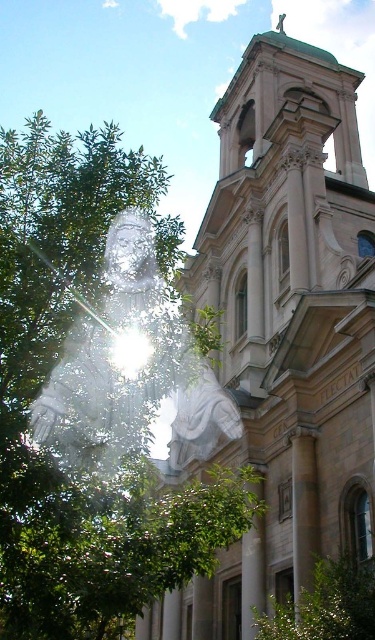
Does white marble church at center have a lesser width compared to green leafy tree at left?

Yes, white marble church at center is thinner than green leafy tree at left.

Does point (360, 358) come closer to viewer compared to point (103, 177)?

No, it is not.

Who is more distant from viewer, (273, 376) or (91, 212)?

Point (273, 376)

Find the location of `white marble church at center`. white marble church at center is located at coordinates (286, 328).

Is point (343, 266) behind point (144, 257)?

Yes, point (343, 266) is farther from viewer.

Which of these two, white marble church at center or white marble statue at center, stands shorter?

white marble statue at center

Is point (265, 179) positioned behind point (49, 387)?

That is True.

Find the location of a particular element. This screenshot has height=640, width=375. white marble church at center is located at coordinates (286, 328).

Does green leafy tree at left have a larger size compared to white marble statue at center?

Yes, green leafy tree at left is bigger than white marble statue at center.

Who is shorter, green leafy tree at left or white marble statue at center?

white marble statue at center

Which is behind, point (1, 369) or point (75, 358)?

The point (75, 358) is behind.

At what (x,y) coordinates should I click in order to perform the action: click on green leafy tree at left. Please return your answer as a coordinate pair (x, y). Looking at the image, I should click on (46, 378).